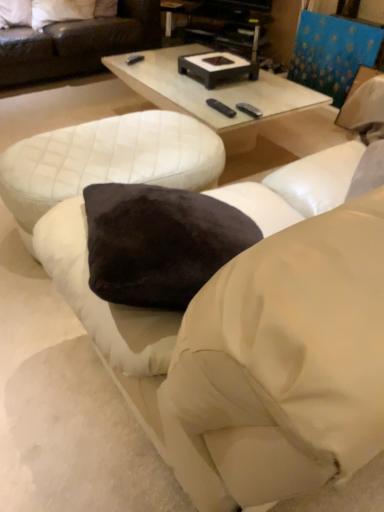
Question: From the image's perspective, is black plastic entertainment center at upper center over white glossy coffee table at center?

Choices:
 (A) yes
 (B) no

Answer: (A)

Question: From the image's perspective, is black plastic entertainment center at upper center located beneath white glossy coffee table at center?

Choices:
 (A) no
 (B) yes

Answer: (A)

Question: Is black plastic entertainment center at upper center placed right next to white glossy coffee table at center?

Choices:
 (A) yes
 (B) no

Answer: (B)

Question: From a real-world perspective, is black plastic entertainment center at upper center on top of white glossy coffee table at center?

Choices:
 (A) no
 (B) yes

Answer: (B)

Question: From a real-world perspective, does black plastic entertainment center at upper center sit lower than white glossy coffee table at center?

Choices:
 (A) no
 (B) yes

Answer: (A)

Question: From the image's perspective, is white soft pillow at upper left, which appears as the 1th pillow when viewed from the right, above or below white quilted ottoman at lower left?

Choices:
 (A) above
 (B) below

Answer: (A)

Question: From a real-world perspective, is white soft pillow at upper left, the 2th pillow in the left-to-right sequence, positioned above or below white quilted ottoman at lower left?

Choices:
 (A) below
 (B) above

Answer: (B)

Question: Is white soft pillow at upper left, which appears as the 1th pillow when viewed from the right, wider or thinner than white quilted ottoman at lower left?

Choices:
 (A) wide
 (B) thin

Answer: (B)

Question: From their relative heights in the image, would you say white soft pillow at upper left, the 2th pillow in the left-to-right sequence, is taller or shorter than white quilted ottoman at lower left?

Choices:
 (A) short
 (B) tall

Answer: (A)

Question: Considering their positions, is velvet dark brown pillow at upper left, placed as the 1th pillow when sorted from left to right, located in front of or behind black plastic entertainment center at upper center?

Choices:
 (A) front
 (B) behind

Answer: (A)

Question: From the image's perspective, is velvet dark brown pillow at upper left, placed as the 1th pillow when sorted from left to right, located above or below black plastic entertainment center at upper center?

Choices:
 (A) above
 (B) below

Answer: (A)

Question: In terms of size, does velvet dark brown pillow at upper left, the 2th pillow in the right-to-left sequence, appear bigger or smaller than black plastic entertainment center at upper center?

Choices:
 (A) big
 (B) small

Answer: (B)

Question: Based on their positions, is velvet dark brown pillow at upper left, the 2th pillow in the right-to-left sequence, located to the left or right of black plastic entertainment center at upper center?

Choices:
 (A) right
 (B) left

Answer: (B)

Question: Does point (279, 133) appear closer or farther from the camera than point (8, 10)?

Choices:
 (A) farther
 (B) closer

Answer: (B)

Question: Considering the positions of white glossy coffee table at center and velvet dark brown pillow at upper left, the 2th pillow in the right-to-left sequence, in the image, is white glossy coffee table at center taller or shorter than velvet dark brown pillow at upper left, the 2th pillow in the right-to-left sequence,?

Choices:
 (A) tall
 (B) short

Answer: (A)